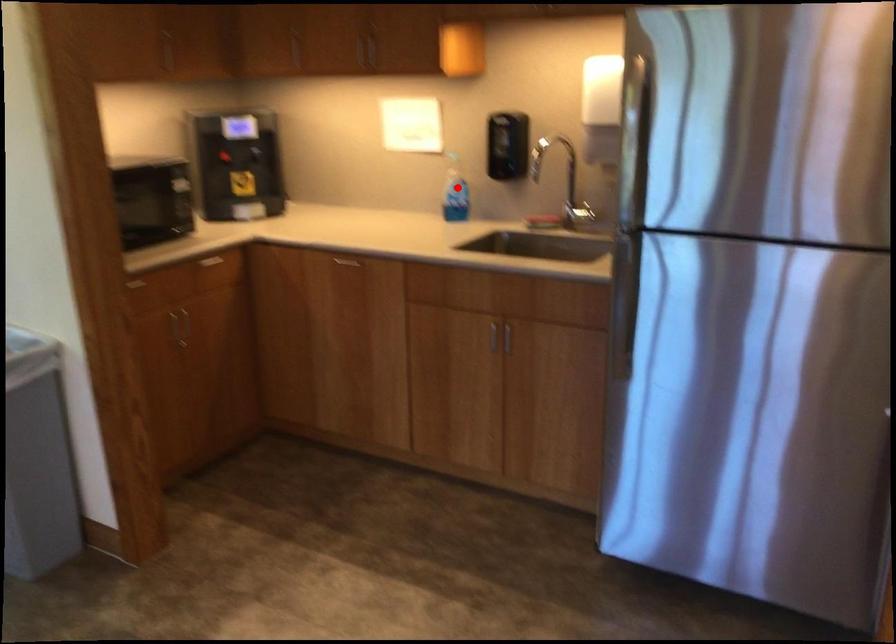
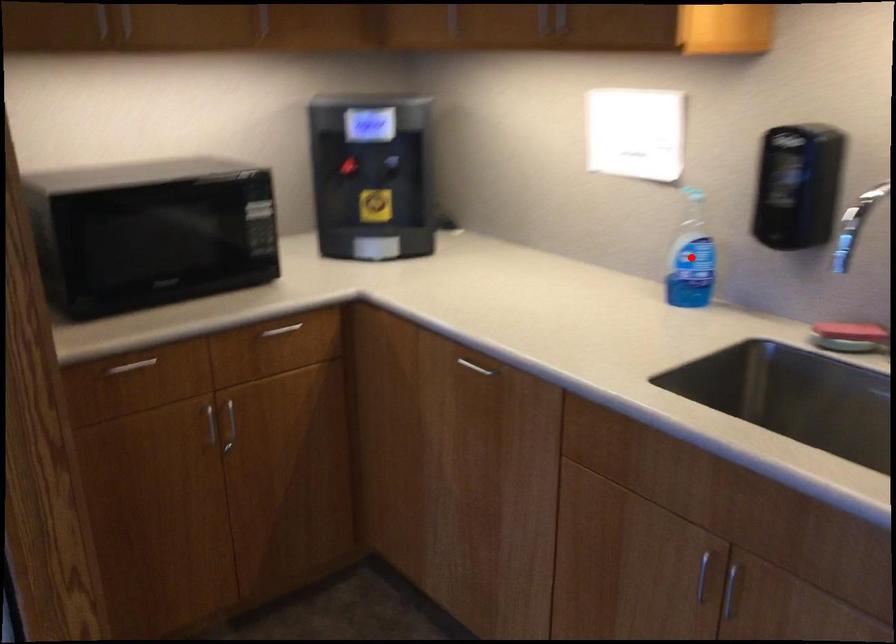
I am providing you with two images of the same scene from different viewpoints. A red point is marked on the first image and another point is marked on the second image. Is the red point in image1 aligned with the point shown in image2?

Yes